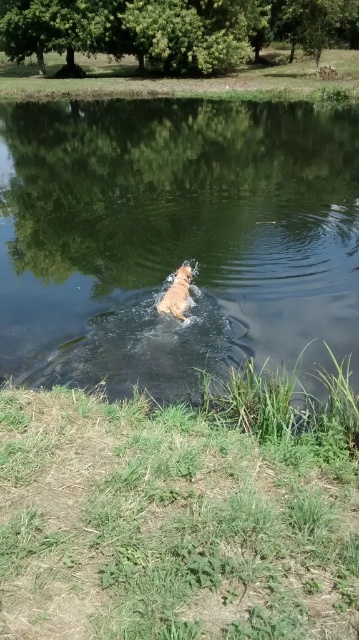
You are a photographer trying to capture the dog swimming in the water. The clear water at center is located at point (174, 240). Where should you position your camera to ensure the dog is fully visible in the frame?

The clear water at center is located at point (174, 240), so positioning the camera at this point would allow the dog to be fully visible in the frame as the clear water at center is where the dog is swimming.

You are a photographer trying to capture the golden fur dog at center in the clear water at center. Can you see the dog through the water?

The clear water at center is positioned over golden fur dog at center, so yes, you can see the dog through the water.

You are standing on the shore of the pond and want to take a photo of the golden fur dog at center. Since the clear water at center is between you and the dog, will the water appear in front of or behind the dog in your photo?

The clear water at center is closer to the viewer than golden fur dog at center, so the water will appear in front of the dog in your photo.